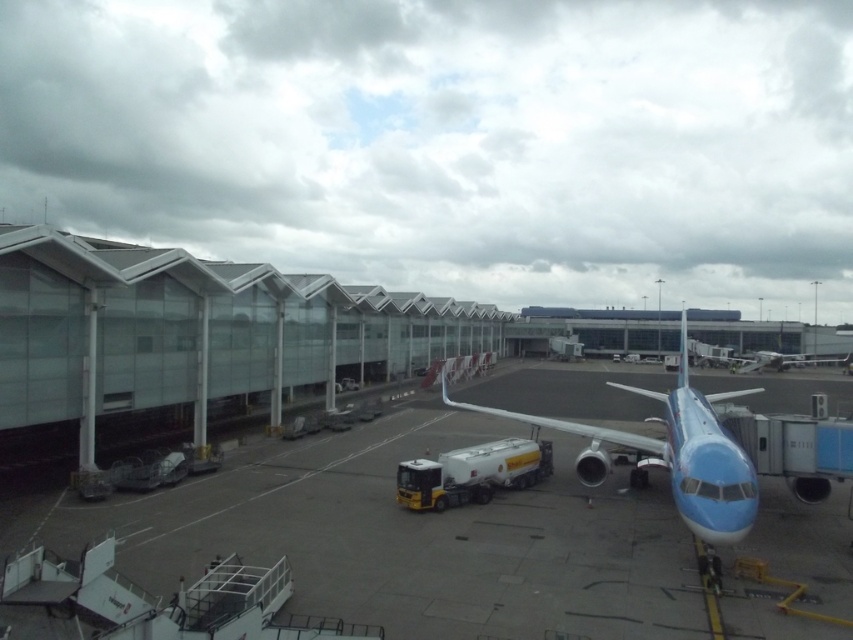
Between point (462, 557) and point (544, 419), which one is positioned behind?

The point (544, 419) is more distant.

Between smooth concrete tarmac at center and blue glossy airplane at center, which one appears on the left side from the viewer's perspective?

smooth concrete tarmac at center

What do you see at coordinates (468, 541) in the screenshot? I see `smooth concrete tarmac at center` at bounding box center [468, 541].

This screenshot has width=853, height=640. What are the coordinates of `smooth concrete tarmac at center` in the screenshot? It's located at (468, 541).